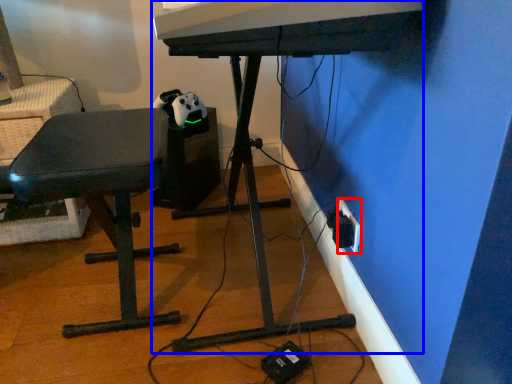
Question: Which of the following is the closest to the observer, electric outlet (highlighted by a red box) or computer desk (highlighted by a blue box)?

Choices:
 (A) electric outlet
 (B) computer desk

Answer: (B)